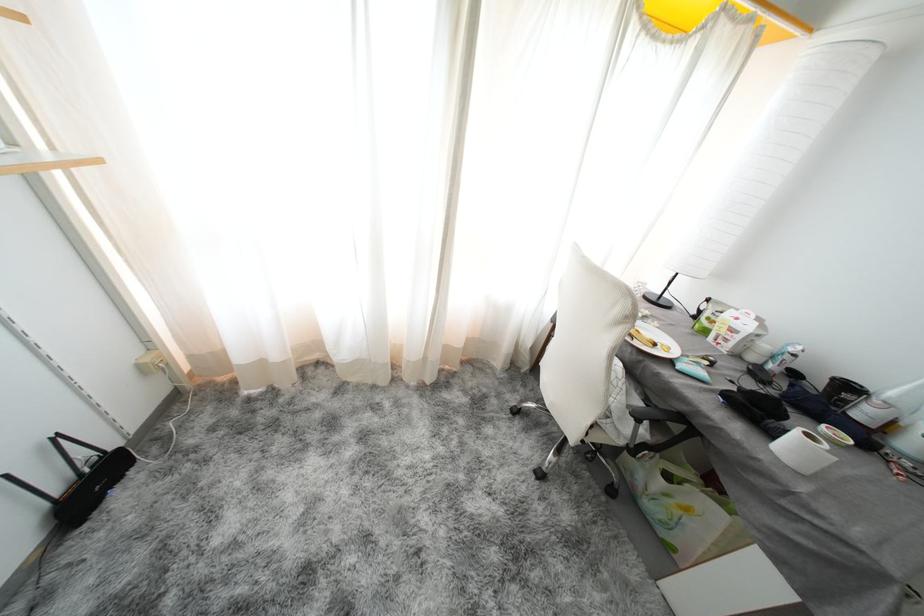
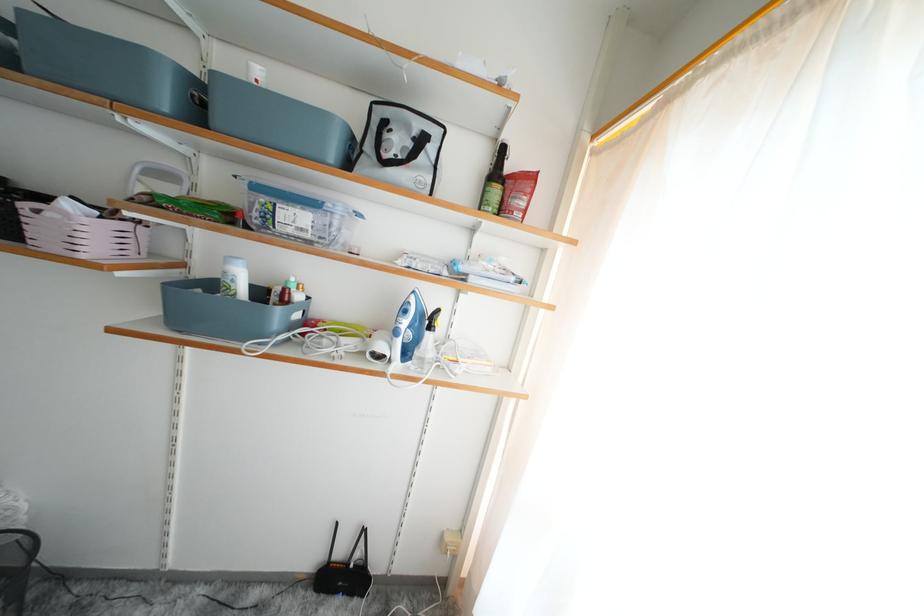
Question: The camera is either moving clockwise (left) or counter-clockwise (right) around the object. The first image is from the beginning of the video and the second image is from the end. Is the camera moving left or right when shooting the video?

Choices:
 (A) Left
 (B) Right

Answer: (B)